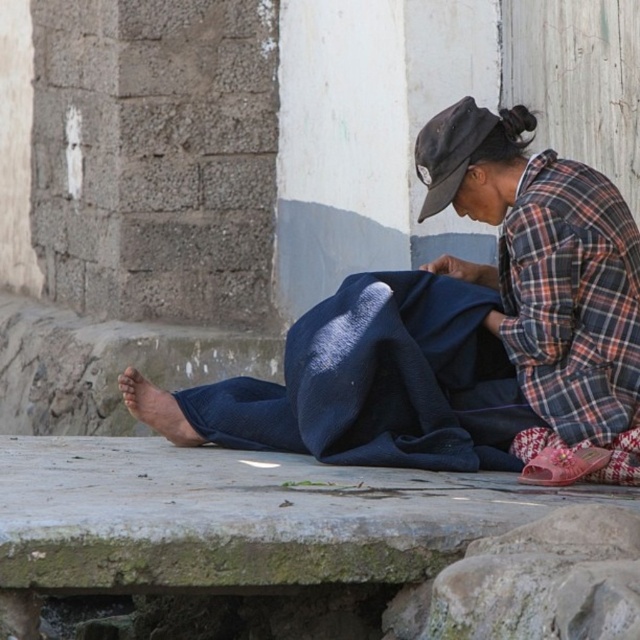
Question: Estimate the real-world distances between objects in this image. Which object is farther from the matte blue fabric at center?

Choices:
 (A) plaid fabric at lower right
 (B) pink fabric sandal at lower right

Answer: (B)

Question: Can you confirm if matte blue fabric at center is bigger than black fabric hat at upper center?

Choices:
 (A) no
 (B) yes

Answer: (B)

Question: Does matte blue fabric at center appear on the left side of black fabric hat at upper center?

Choices:
 (A) no
 (B) yes

Answer: (B)

Question: Where is matte blue fabric at center located in relation to pink fabric sandal at lower right in the image?

Choices:
 (A) right
 (B) left

Answer: (B)

Question: Which point appears farthest from the camera in this image?

Choices:
 (A) (570, 461)
 (B) (444, 312)

Answer: (B)

Question: Which of the following is the farthest from the observer?

Choices:
 (A) (x=545, y=148)
 (B) (x=545, y=448)

Answer: (A)